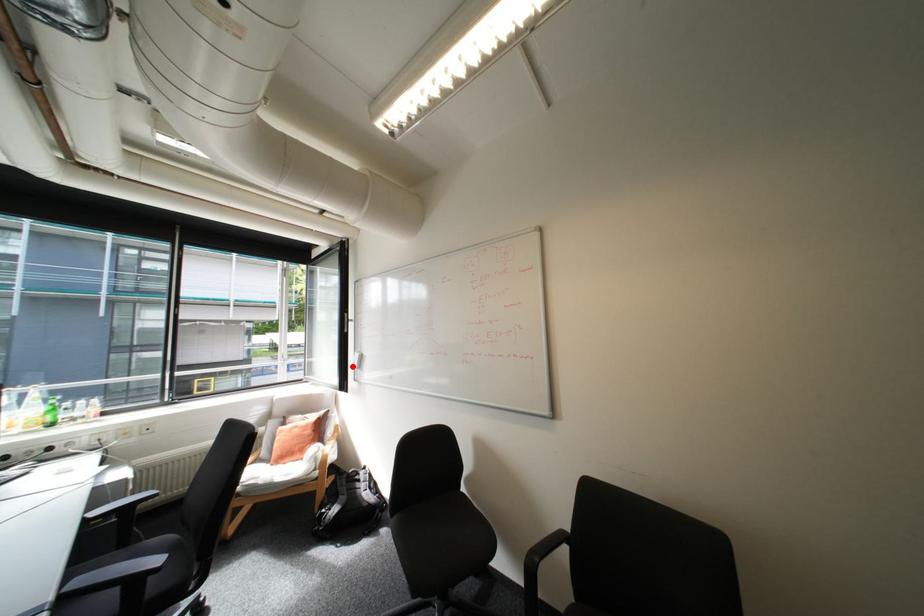
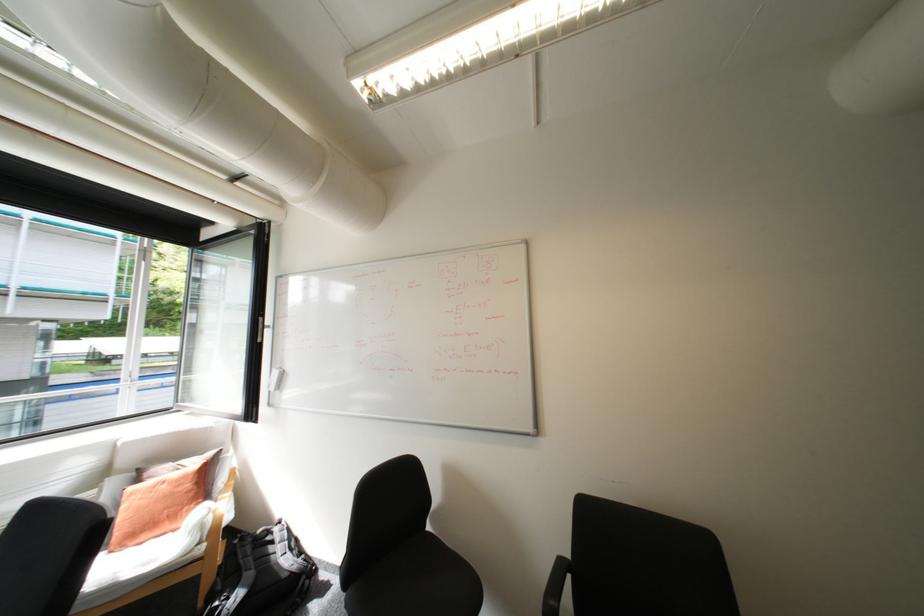
Where in the second image is the point corresponding to the highlighted location from the first image?

(261, 387)